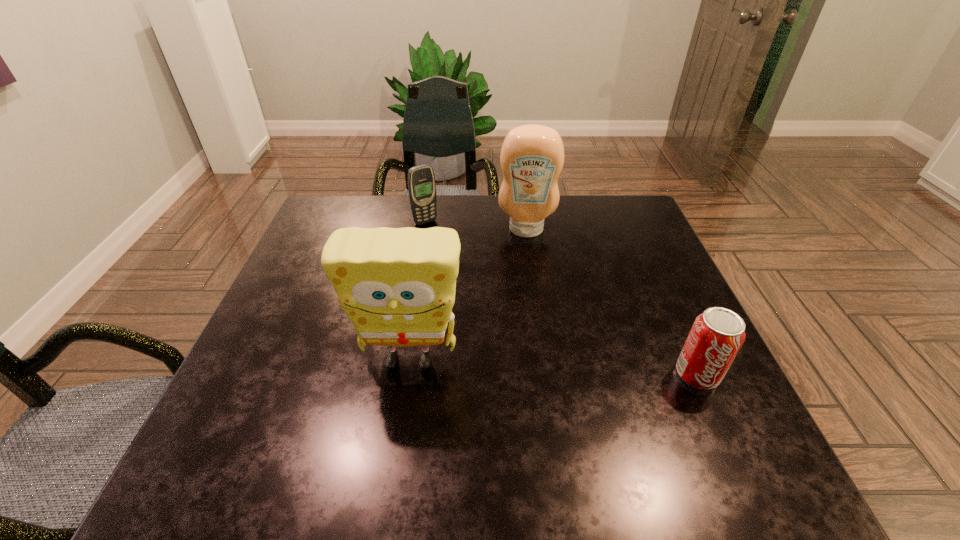
At what (x,y) coordinates should I click in order to perform the action: click on free spot on the desktop that is between the sponge and the rightmost object and is positioned on the screen of the cellular telephone. Please return your answer as a coordinate pair (x, y). This screenshot has width=960, height=540. Looking at the image, I should click on (545, 367).

This screenshot has height=540, width=960. In order to click on free space on the desktop that is between the sponge and the soda can and is positioned on the label of the condiment in this screenshot , I will do `click(527, 366)`.